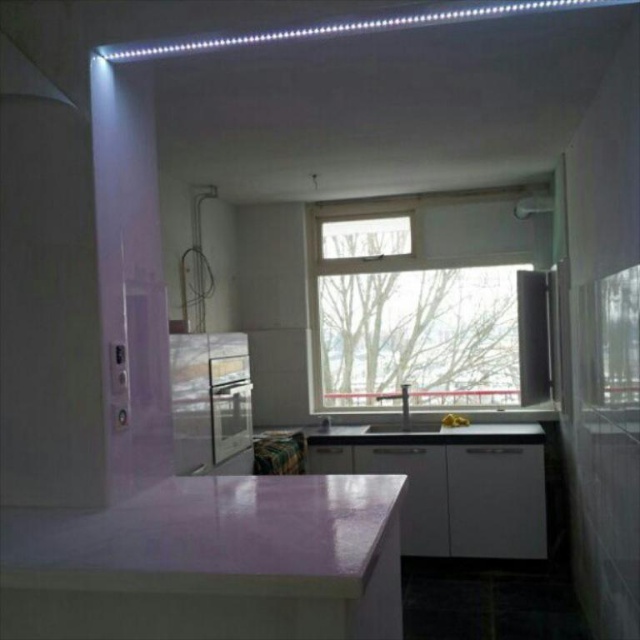
Which is above, pink glossy countertop at lower center or metallic stainless steel sink at center?

metallic stainless steel sink at center is above.

Image resolution: width=640 pixels, height=640 pixels. Describe the element at coordinates (211, 561) in the screenshot. I see `pink glossy countertop at lower center` at that location.

Where is `pink glossy countertop at lower center`? The image size is (640, 640). pink glossy countertop at lower center is located at coordinates 211,561.

Is point (17, 51) less distant than point (380, 394)?

Yes, it is in front of point (380, 394).

Does matte white exhaust hood at upper left lie in front of white glossy sink at center?

That is True.

Which is in front, point (12, 88) or point (422, 432)?

Positioned in front is point (12, 88).

Image resolution: width=640 pixels, height=640 pixels. In order to click on matte white exhaust hood at upper left in this screenshot , I will do click(26, 74).

Does metallic stainless steel sink at center have a greater width compared to white glossy sink at center?

No, metallic stainless steel sink at center is not wider than white glossy sink at center.

Who is more forward, (189, 381) or (406, 419)?

Positioned in front is point (189, 381).

The image size is (640, 640). What do you see at coordinates (211, 401) in the screenshot?
I see `metallic stainless steel sink at center` at bounding box center [211, 401].

Image resolution: width=640 pixels, height=640 pixels. Identify the location of metallic stainless steel sink at center. (x=211, y=401).